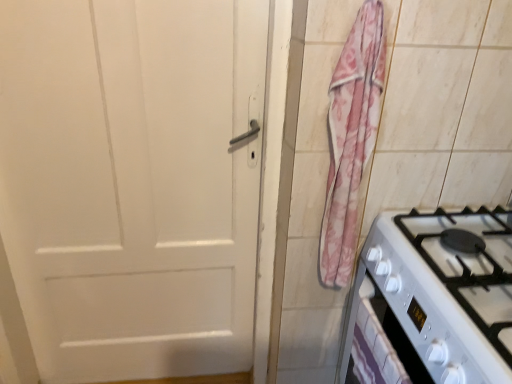
Question: In the image, is white glossy gas stove at lower right on the left side or the right side of pink floral fabric at right?

Choices:
 (A) left
 (B) right

Answer: (B)

Question: Is white glossy gas stove at lower right wider or thinner than pink floral fabric at right?

Choices:
 (A) thin
 (B) wide

Answer: (B)

Question: Considering the real-world distances, which object is farthest from the white glossy drawer at lower right?

Choices:
 (A) white glossy gas stove at lower right
 (B) pink floral fabric at right

Answer: (B)

Question: Estimate the real-world distances between objects in this image. Which object is farther from the white glossy drawer at lower right?

Choices:
 (A) pink floral fabric at right
 (B) white glossy gas stove at lower right

Answer: (A)